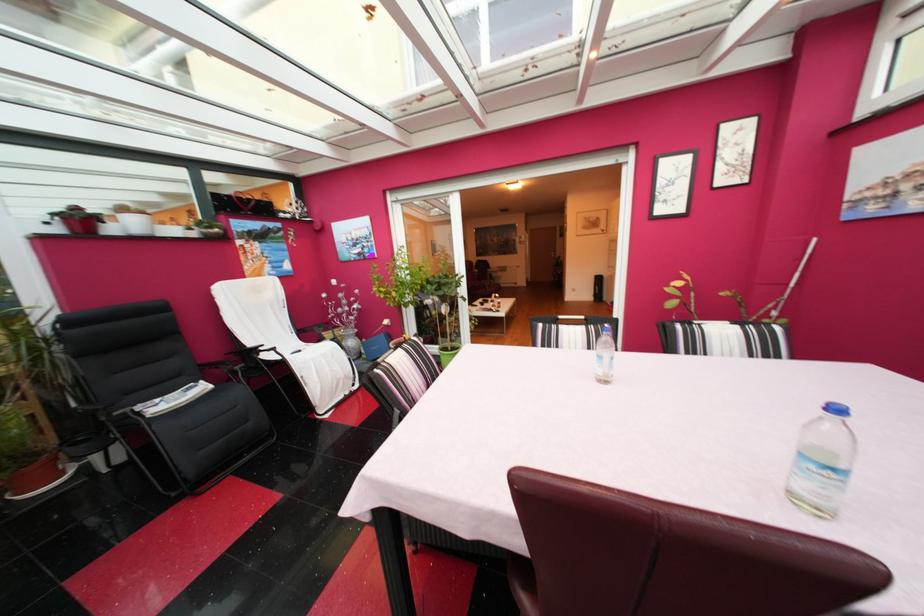
Where would you sit the white chair sitting surface? Please return your answer as a coordinate pair (x, y).

(293, 350)